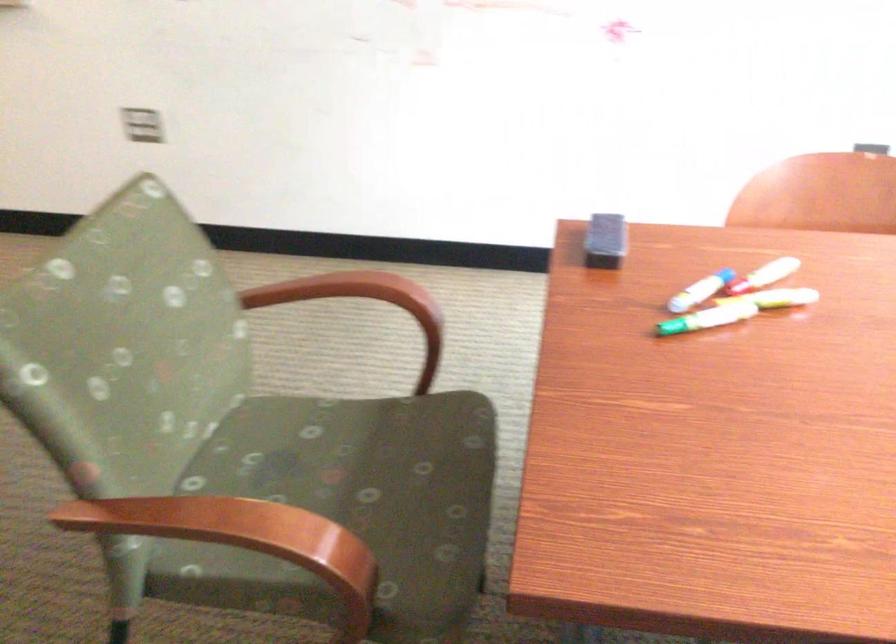
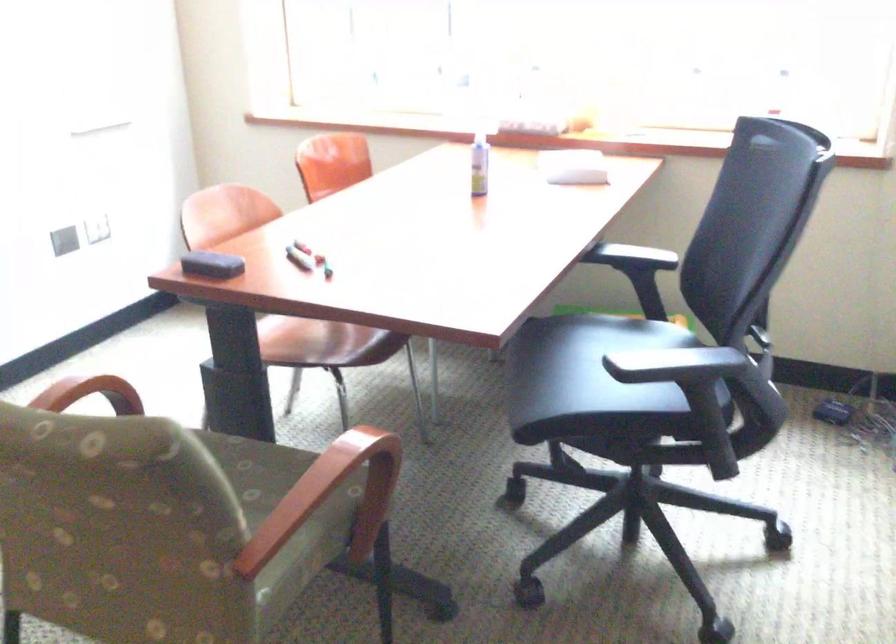
Where in the second image is the point corresponding to point (186, 560) from the first image?

(331, 496)